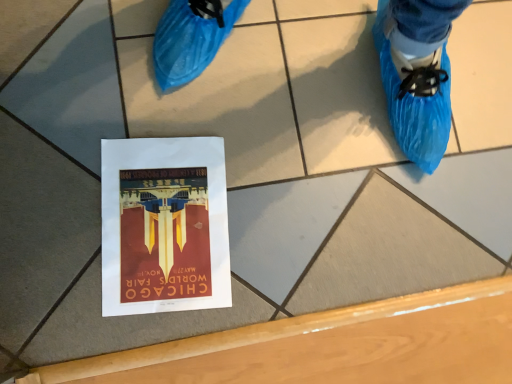
Locate an element on the screen. The image size is (512, 384). matte paper poster at center is located at coordinates (164, 225).

Looking at this image, in order to face matte paper poster at center, should I rotate leftwards or rightwards?

Turn left by 11.672 degrees to look at matte paper poster at center.

Describe the element at coordinates (164, 225) in the screenshot. I see `matte paper poster at center` at that location.

The width and height of the screenshot is (512, 384). Find the location of `matte paper poster at center`. matte paper poster at center is located at coordinates (164, 225).